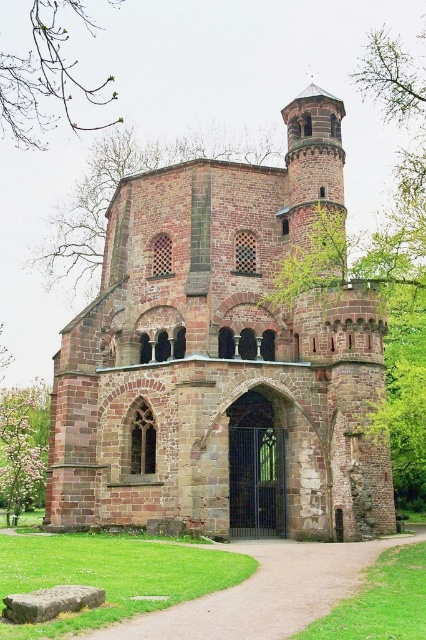
You are standing in front of the historic stone structure and want to take a photo of both the green leafy branches at upper left and the green leafy tree at lower left. Which one should you focus on first to ensure both are in sharp focus?

You should focus on the green leafy tree at lower left first because it is farther away from the viewer than the green leafy branches at upper left. By focusing on the farther object, the closer one will also be in focus due to the depth of field.

You are standing in front of the brown stone church at center and looking up. Do you see the green leafy branches at upper left above the church?

Yes, the brown stone church at center is positioned under green leafy branches at upper left, so when looking up from the church, the branches are above it.